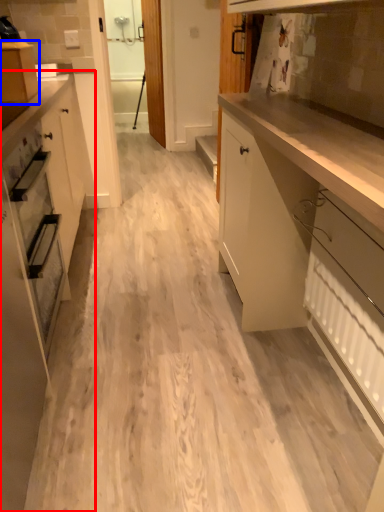
Question: Which of the following is the farthest to the observer, cabinetry (highlighted by a red box) or cabinetry (highlighted by a blue box)?

Choices:
 (A) cabinetry
 (B) cabinetry

Answer: (B)